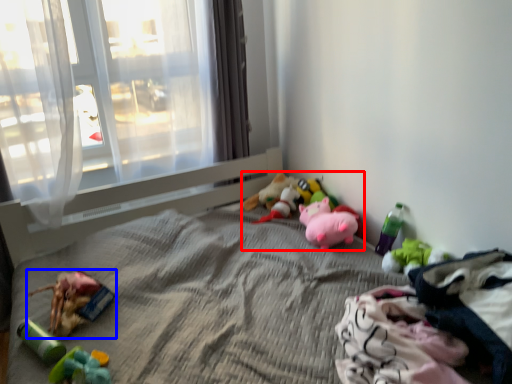
Question: Which object is further to the camera taking this photo, toy (highlighted by a red box) or toy (highlighted by a blue box)?

Choices:
 (A) toy
 (B) toy

Answer: (A)